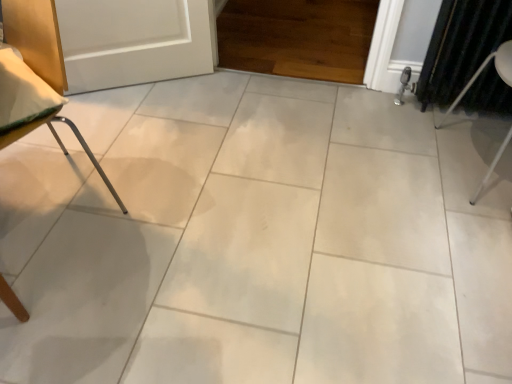
This screenshot has width=512, height=384. In order to click on white metal chair at right, the first furniture positioned from the right in this screenshot , I will do `click(483, 69)`.

You are a GUI agent. You are given a task and a screenshot of the screen. Output one action in this format:
    pyautogui.click(x=<x>, y=<y>)
    Task: Click on the metallic silver chair leg at left, positioned as the second furniture in right-to-left order
    The image size is (512, 384).
    Given the screenshot: What is the action you would take?
    pyautogui.click(x=33, y=107)

Which is more to the right, dark green fabric curtain at right or metallic silver chair leg at left, positioned as the second furniture in right-to-left order?

dark green fabric curtain at right is more to the right.

Is dark green fabric curtain at right wider or thinner than metallic silver chair leg at left, marked as the 1th furniture in a left-to-right arrangement?

Clearly, dark green fabric curtain at right has less width compared to metallic silver chair leg at left, marked as the 1th furniture in a left-to-right arrangement.

Find the location of `curtain behind the metallic silver chair leg at left, positioned as the second furniture in right-to-left order`. curtain behind the metallic silver chair leg at left, positioned as the second furniture in right-to-left order is located at coordinates (461, 46).

Is point (502, 18) closer or farther from the camera than point (47, 96)?

Point (502, 18).

Can you confirm if metallic silver chair leg at left, positioned as the second furniture in right-to-left order, is bigger than dark green fabric curtain at right?

Correct, metallic silver chair leg at left, positioned as the second furniture in right-to-left order, is larger in size than dark green fabric curtain at right.

Considering the relative sizes of metallic silver chair leg at left, positioned as the second furniture in right-to-left order, and dark green fabric curtain at right in the image provided, is metallic silver chair leg at left, positioned as the second furniture in right-to-left order, thinner than dark green fabric curtain at right?

In fact, metallic silver chair leg at left, positioned as the second furniture in right-to-left order, might be wider than dark green fabric curtain at right.

Would you say metallic silver chair leg at left, marked as the 1th furniture in a left-to-right arrangement, is outside dark green fabric curtain at right?

Yes, metallic silver chair leg at left, marked as the 1th furniture in a left-to-right arrangement, is outside of dark green fabric curtain at right.

Is metallic silver chair leg at left, positioned as the second furniture in right-to-left order, far away from dark green fabric curtain at right?

Yes, metallic silver chair leg at left, positioned as the second furniture in right-to-left order, is far from dark green fabric curtain at right.

Between point (509, 40) and point (122, 203), which one is positioned behind?

Point (509, 40)

In the image, is white metal chair at right, the first furniture positioned from the right, on the left side or the right side of metallic silver chair leg at left, positioned as the second furniture in right-to-left order?

white metal chair at right, the first furniture positioned from the right, is positioned on metallic silver chair leg at left, positioned as the second furniture in right-to-left order,'s right side.

Is white metal chair at right, the first furniture positioned from the right, facing away from metallic silver chair leg at left, positioned as the second furniture in right-to-left order?

No, white metal chair at right, the first furniture positioned from the right,'s orientation is not away from metallic silver chair leg at left, positioned as the second furniture in right-to-left order.

Is white metal chair at right, the first furniture positioned from the right, closer to the viewer compared to metallic silver chair leg at left, marked as the 1th furniture in a left-to-right arrangement?

No, white metal chair at right, the first furniture positioned from the right, is further to the viewer.

Would you consider dark green fabric curtain at right to be distant from white metal chair at right, the first furniture positioned from the right?

dark green fabric curtain at right is near white metal chair at right, the first furniture positioned from the right, not far away.

From a real-world perspective, is dark green fabric curtain at right above or below white metal chair at right, the second furniture viewed from the left?

dark green fabric curtain at right is situated lower than white metal chair at right, the second furniture viewed from the left, in the real world.

Which is closer to the camera, (448,31) or (499,153)?

The point (499,153) is more forward.

From their relative heights in the image, would you say dark green fabric curtain at right is taller or shorter than white metal chair at right, the second furniture viewed from the left?

In the image, dark green fabric curtain at right appears to be shorter than white metal chair at right, the second furniture viewed from the left.

From a real-world perspective, which object rests below the other?

dark green fabric curtain at right, from a real-world perspective.

Which of these two, white metal chair at right, the first furniture positioned from the right, or dark green fabric curtain at right, is wider?

Wider between the two is white metal chair at right, the first furniture positioned from the right.

Looking at the image, does white metal chair at right, the first furniture positioned from the right, seem bigger or smaller compared to dark green fabric curtain at right?

Considering their sizes, white metal chair at right, the first furniture positioned from the right, takes up more space than dark green fabric curtain at right.

Which is in front, metallic silver chair leg at left, marked as the 1th furniture in a left-to-right arrangement, or white metal chair at right, the second furniture viewed from the left?

metallic silver chair leg at left, marked as the 1th furniture in a left-to-right arrangement, is in front.

From the picture: Which of these two, metallic silver chair leg at left, positioned as the second furniture in right-to-left order, or white metal chair at right, the second furniture viewed from the left, is bigger?

metallic silver chair leg at left, positioned as the second furniture in right-to-left order.

At what (x,y) coordinates should I click in order to perform the action: click on curtain that appears behind the metallic silver chair leg at left, positioned as the second furniture in right-to-left order. Please return your answer as a coordinate pair (x, y). This screenshot has height=384, width=512. Looking at the image, I should click on (461, 46).

Locate an element on the screen. curtain lying above the metallic silver chair leg at left, marked as the 1th furniture in a left-to-right arrangement (from the image's perspective) is located at coordinates (461, 46).

Estimate the real-world distances between objects in this image. Which object is closer to metallic silver chair leg at left, positioned as the second furniture in right-to-left order, white metal chair at right, the first furniture positioned from the right, or dark green fabric curtain at right?

The object closer to metallic silver chair leg at left, positioned as the second furniture in right-to-left order, is dark green fabric curtain at right.

Which object lies nearer to the anchor point metallic silver chair leg at left, marked as the 1th furniture in a left-to-right arrangement, dark green fabric curtain at right or white metal chair at right, the second furniture viewed from the left?

Based on the image, dark green fabric curtain at right appears to be nearer to metallic silver chair leg at left, marked as the 1th furniture in a left-to-right arrangement.

Which object lies further to the anchor point dark green fabric curtain at right, white metal chair at right, the second furniture viewed from the left, or metallic silver chair leg at left, positioned as the second furniture in right-to-left order?

metallic silver chair leg at left, positioned as the second furniture in right-to-left order.

Estimate the real-world distances between objects in this image. Which object is further from white metal chair at right, the second furniture viewed from the left, metallic silver chair leg at left, positioned as the second furniture in right-to-left order, or dark green fabric curtain at right?

Based on the image, metallic silver chair leg at left, positioned as the second furniture in right-to-left order, appears to be further to white metal chair at right, the second furniture viewed from the left.

When comparing their distances from dark green fabric curtain at right, does metallic silver chair leg at left, marked as the 1th furniture in a left-to-right arrangement, or white metal chair at right, the second furniture viewed from the left, seem closer?

white metal chair at right, the second furniture viewed from the left, is closer to dark green fabric curtain at right.

When comparing their distances from white metal chair at right, the first furniture positioned from the right, does dark green fabric curtain at right or metallic silver chair leg at left, positioned as the second furniture in right-to-left order, seem closer?

dark green fabric curtain at right.

Identify the location of curtain situated between metallic silver chair leg at left, positioned as the second furniture in right-to-left order, and white metal chair at right, the second furniture viewed from the left, from left to right. (461, 46).